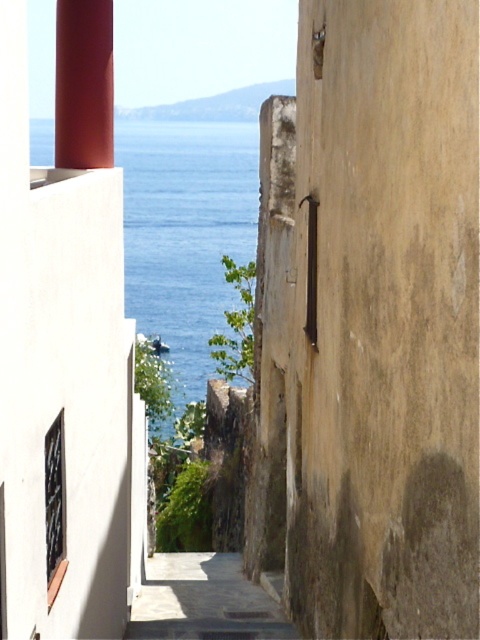
Who is shorter, smooth concrete pillar at center or blue water at center?

With less height is smooth concrete pillar at center.

Does smooth concrete pillar at center appear on the right side of blue water at center?

Yes, smooth concrete pillar at center is to the right of blue water at center.

Describe the element at coordinates (372, 321) in the screenshot. I see `smooth concrete pillar at center` at that location.

Locate an element on the screen. Image resolution: width=480 pixels, height=640 pixels. smooth concrete pillar at center is located at coordinates (372, 321).